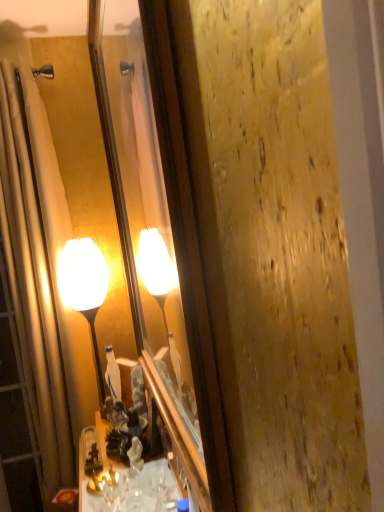
I want to click on matte glass mirror at center, so click(x=160, y=236).

Is point (176, 490) farther from camera compared to point (16, 358)?

No, it is not.

Locate an element on the screen. shower curtain that appears behind the shiny brass cabinet at lower center is located at coordinates (35, 277).

Is shiny brass cabinet at lower center oriented away from beige fabric shower curtain at left?

No, shiny brass cabinet at lower center is not facing the opposite direction of beige fabric shower curtain at left.

Considering the relative sizes of matte glass mirror at center and beige fabric shower curtain at left in the image provided, is matte glass mirror at center smaller than beige fabric shower curtain at left?

Indeed, matte glass mirror at center has a smaller size compared to beige fabric shower curtain at left.

Looking at this image, from a real-world perspective, which is physically above, matte glass mirror at center or beige fabric shower curtain at left?

matte glass mirror at center.

In order to click on shower curtain behind the matte glass mirror at center in this screenshot , I will do `click(35, 277)`.

What's the angular difference between matte glass mirror at center and beige fabric shower curtain at left's facing directions?

The angular difference between matte glass mirror at center and beige fabric shower curtain at left is 91 degrees.

From a real-world perspective, is matte glass lamp at center on top of matte glass mirror at center?

No, from a real-world perspective, matte glass lamp at center is not over matte glass mirror at center

Is matte glass lamp at center far away from matte glass mirror at center?

They are positioned close to each other.

Does matte glass lamp at center appear on the right side of matte glass mirror at center?

Incorrect, matte glass lamp at center is not on the right side of matte glass mirror at center.

In the image, is matte glass lamp at center positioned in front of or behind matte glass mirror at center?

Visually, matte glass lamp at center is located behind matte glass mirror at center.

Is beige fabric shower curtain at left to the right of shiny brass cabinet at lower center from the viewer's perspective?

In fact, beige fabric shower curtain at left is to the left of shiny brass cabinet at lower center.

From the image's perspective, is beige fabric shower curtain at left located beneath shiny brass cabinet at lower center?

No, from the image's perspective, beige fabric shower curtain at left is not below shiny brass cabinet at lower center.

From a real-world perspective, which object stands above the other?

beige fabric shower curtain at left.

Is shiny brass cabinet at lower center inside beige fabric shower curtain at left?

No, shiny brass cabinet at lower center is not a part of beige fabric shower curtain at left.

From the image's perspective, is matte glass lamp at center located above shiny brass cabinet at lower center?

Yes, from the image's perspective, matte glass lamp at center is on top of shiny brass cabinet at lower center.

Considering the positions of objects matte glass lamp at center and shiny brass cabinet at lower center in the image provided, who is more to the right, matte glass lamp at center or shiny brass cabinet at lower center?

shiny brass cabinet at lower center.

Between matte glass lamp at center and shiny brass cabinet at lower center, which one has larger width?

With larger width is shiny brass cabinet at lower center.

Is point (128, 83) positioned after point (102, 277)?

That is False.

Can matte glass lamp at center be found inside matte glass mirror at center?

No, matte glass mirror at center does not contain matte glass lamp at center.

Identify the location of lamp located on the left of matte glass mirror at center. This screenshot has height=512, width=384. (84, 288).

How distant is matte glass lamp at center from beige fabric shower curtain at left?

The distance of matte glass lamp at center from beige fabric shower curtain at left is 8.10 inches.

Which of these two, matte glass lamp at center or beige fabric shower curtain at left, is smaller?

Smaller between the two is matte glass lamp at center.

What's the angular difference between matte glass lamp at center and beige fabric shower curtain at left's facing directions?

The angular difference between matte glass lamp at center and beige fabric shower curtain at left is 51.5 degrees.

Considering the relative sizes of matte glass lamp at center and beige fabric shower curtain at left in the image provided, is matte glass lamp at center shorter than beige fabric shower curtain at left?

Yes, matte glass lamp at center is shorter than beige fabric shower curtain at left.

I want to click on cabinetry lying on the right of beige fabric shower curtain at left, so click(x=164, y=477).

Find the location of a particular element. Image resolution: width=384 pixels, height=512 pixels. shower curtain that appears below the matte glass mirror at center (from a real-world perspective) is located at coordinates (35, 277).

When comparing their distances from matte glass lamp at center, does matte glass mirror at center or beige fabric shower curtain at left seem closer?

beige fabric shower curtain at left lies closer to matte glass lamp at center than the other object.

From the image, which object appears to be nearer to matte glass mirror at center, matte glass lamp at center or beige fabric shower curtain at left?

Based on the image, matte glass lamp at center appears to be nearer to matte glass mirror at center.

Which object lies nearer to the anchor point matte glass lamp at center, beige fabric shower curtain at left or matte glass mirror at center?

The object closer to matte glass lamp at center is beige fabric shower curtain at left.

Based on their spatial positions, is beige fabric shower curtain at left or matte glass lamp at center closer to matte glass mirror at center?

matte glass lamp at center is closer to matte glass mirror at center.

From the image, which object appears to be farther from beige fabric shower curtain at left, matte glass lamp at center or shiny brass cabinet at lower center?

Based on the image, shiny brass cabinet at lower center appears to be further to beige fabric shower curtain at left.

From the image, which object appears to be nearer to shiny brass cabinet at lower center, beige fabric shower curtain at left or matte glass lamp at center?

Based on the image, matte glass lamp at center appears to be nearer to shiny brass cabinet at lower center.

Which object lies nearer to the anchor point matte glass lamp at center, matte glass mirror at center or shiny brass cabinet at lower center?

Among the two, shiny brass cabinet at lower center is located nearer to matte glass lamp at center.

From the image, which object appears to be nearer to matte glass mirror at center, matte glass lamp at center or shiny brass cabinet at lower center?

The object closer to matte glass mirror at center is shiny brass cabinet at lower center.

The height and width of the screenshot is (512, 384). I want to click on lamp between matte glass mirror at center and beige fabric shower curtain at left in the front-back direction, so click(x=84, y=288).

Find the location of `cabinetry between matte glass mirror at center and matte glass lamp at center in the front-back direction`. cabinetry between matte glass mirror at center and matte glass lamp at center in the front-back direction is located at coordinates (164, 477).

The width and height of the screenshot is (384, 512). Find the location of `cabinetry between matte glass mirror at center and beige fabric shower curtain at left in the front-back direction`. cabinetry between matte glass mirror at center and beige fabric shower curtain at left in the front-back direction is located at coordinates (164, 477).

Image resolution: width=384 pixels, height=512 pixels. In order to click on lamp located between shiny brass cabinet at lower center and beige fabric shower curtain at left in the depth direction in this screenshot , I will do `click(84, 288)`.